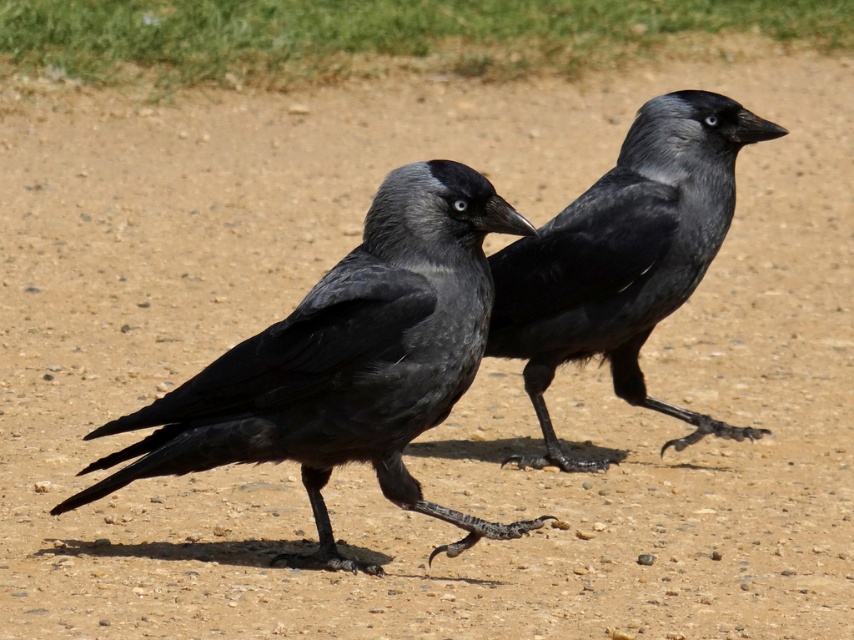
Which is behind, point (442, 216) or point (578, 275)?

The point (578, 275) is behind.

This screenshot has height=640, width=854. Find the location of `matte black raven at center`. matte black raven at center is located at coordinates (347, 362).

Which is in front, point (445, 241) or point (540, 396)?

Positioned in front is point (445, 241).

Where is `matte black raven at center`? This screenshot has height=640, width=854. matte black raven at center is located at coordinates (347, 362).